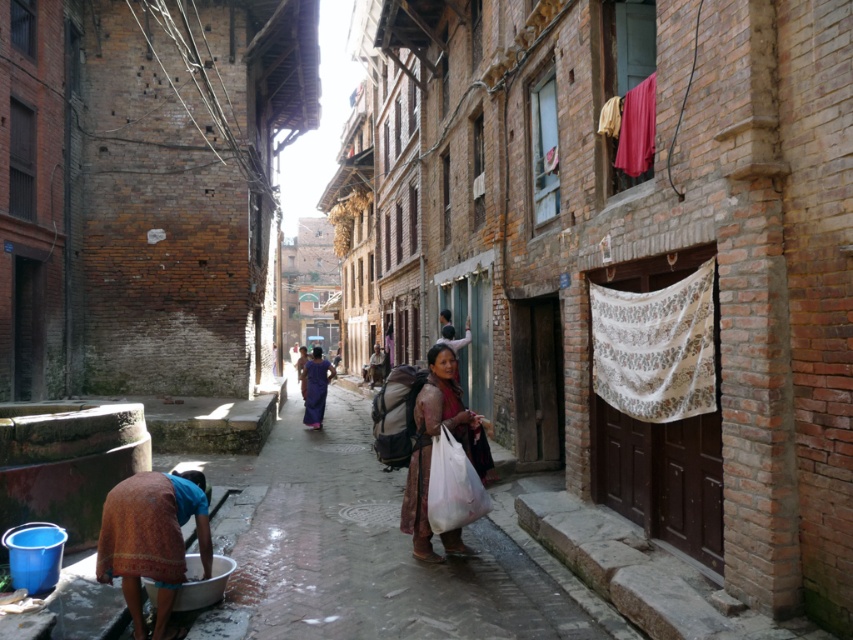
You are a delivery person trying to navigate through the narrow alleyway. You see a brown woven cloth at lower left and a brown textured shawl at center. Which item is shorter in height?

The brown woven cloth at lower left is not as tall as the brown textured shawl at center, so the brown woven cloth at lower left is shorter in height.